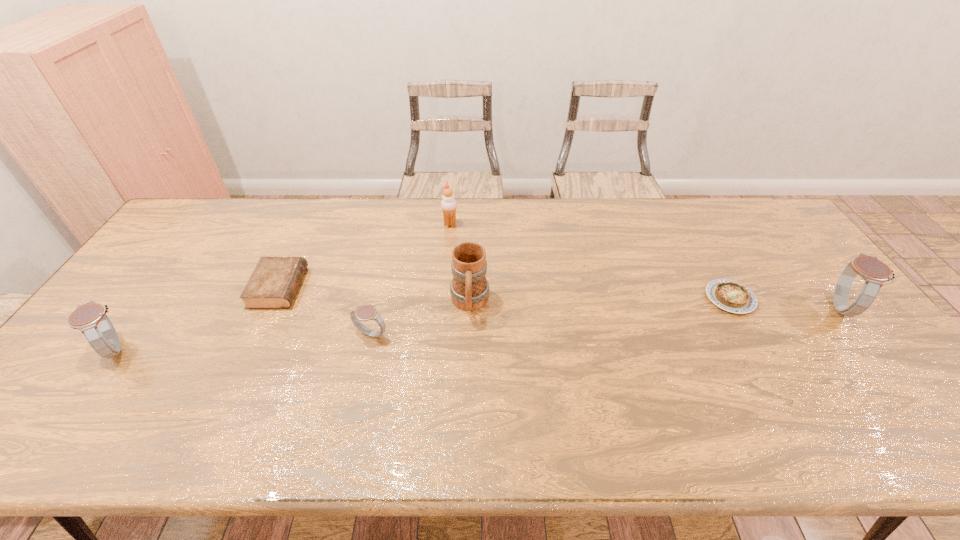
Locate an element on the screen. This screenshot has width=960, height=540. free space that is in between the fourth tallest object and the rightmost object is located at coordinates (478, 328).

Find the location of a particular element. The height and width of the screenshot is (540, 960). vacant space in between the quiche and the diary is located at coordinates (504, 293).

Point out which object is positioned as the fifth nearest to the leftmost object. Please provide its 2D coordinates. Your answer should be formatted as a tuple, i.e. [(x, y)], where the tuple contains the x and y coordinates of a point satisfying the conditions above.

[(729, 295)]

You are a GUI agent. You are given a task and a screenshot of the screen. Output one action in this format:
    pyautogui.click(x=<x>, y=<y>)
    Task: Click on the object that ranks as the closest to the rightmost object
    The height and width of the screenshot is (540, 960).
    Given the screenshot: What is the action you would take?
    pyautogui.click(x=729, y=295)

At what (x,y) coordinates should I click in order to perform the action: click on watch that is the closest to the shortest object. Please return your answer as a coordinate pair (x, y). Looking at the image, I should click on (874, 272).

Where is `watch identified as the closest to the second watch from left to right`? The height and width of the screenshot is (540, 960). watch identified as the closest to the second watch from left to right is located at coordinates (90, 318).

This screenshot has width=960, height=540. Identify the location of free spot that satisfies the following two spatial constraints: 1. at the front with a straw on the farthest object; 2. on the back side of the shortest object. (444, 298).

The width and height of the screenshot is (960, 540). I want to click on vacant region that satisfies the following two spatial constraints: 1. on the spine side of the second object from left to right; 2. on the front side of the fourth shortest object, so click(x=251, y=348).

The image size is (960, 540). Identify the location of free location that satisfies the following two spatial constraints: 1. on the spine side of the second watch from left to right; 2. on the left side of the sixth tallest object. (257, 334).

Find the location of a particular element. Image resolution: width=960 pixels, height=540 pixels. vacant area that satisfies the following two spatial constraints: 1. on the side of the rightmost watch with the handle; 2. on the right side of the mug is located at coordinates (469, 307).